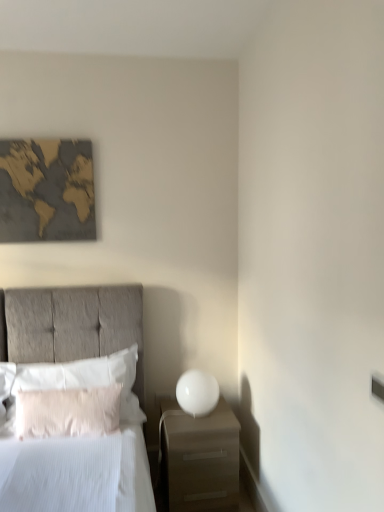
You are a GUI agent. You are given a task and a screenshot of the screen. Output one action in this format:
    pyautogui.click(x=<x>, y=<y>)
    Task: Click on the free space above matte white nightstand at lower right (from a real-world perspective)
    
    Given the screenshot: What is the action you would take?
    pyautogui.click(x=195, y=418)